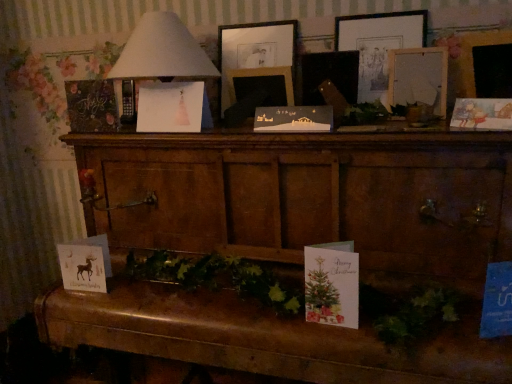
Question: From the image's perspective, is wooden chest at center positioned above or below pink paper christmas card at center, acting as the 2th christmas card starting from the top?

Choices:
 (A) above
 (B) below

Answer: (B)

Question: From a real-world perspective, is wooden chest at center above or below pink paper christmas card at center, the third christmas card viewed from the left?

Choices:
 (A) below
 (B) above

Answer: (A)

Question: Which object is positioned closest to the matte black picture frame at center, the second picture frame when ordered from right to left?

Choices:
 (A) matte black picture frame at center, which is the 2th picture frame from left to right
 (B) wooden picture frame at upper center, the 4th picture frame from the left
 (C) matte gold card with reindeer at lower left, the 2th christmas card from the left
 (D) chalkboard paper at left, the 1th christmas card viewed from the left
 (E) wooden picture frame at upper center, marked as the fourth picture frame in a right-to-left arrangement

Answer: (A)

Question: Which of these objects is positioned farthest from the matte black picture frame at center, the third picture frame when ordered from left to right?

Choices:
 (A) matte paper card at right, which ranks as the fifth christmas card in left-to-right order
 (B) white paper christmas card at center, arranged as the 2th christmas card when viewed from the right
 (C) chalkboard paper at left, the fifth christmas card when ordered from right to left
 (D) matte gold card with reindeer at lower left, the 4th christmas card viewed from the right
 (E) matte black picture frame at center, which is the 2th picture frame from left to right

Answer: (D)